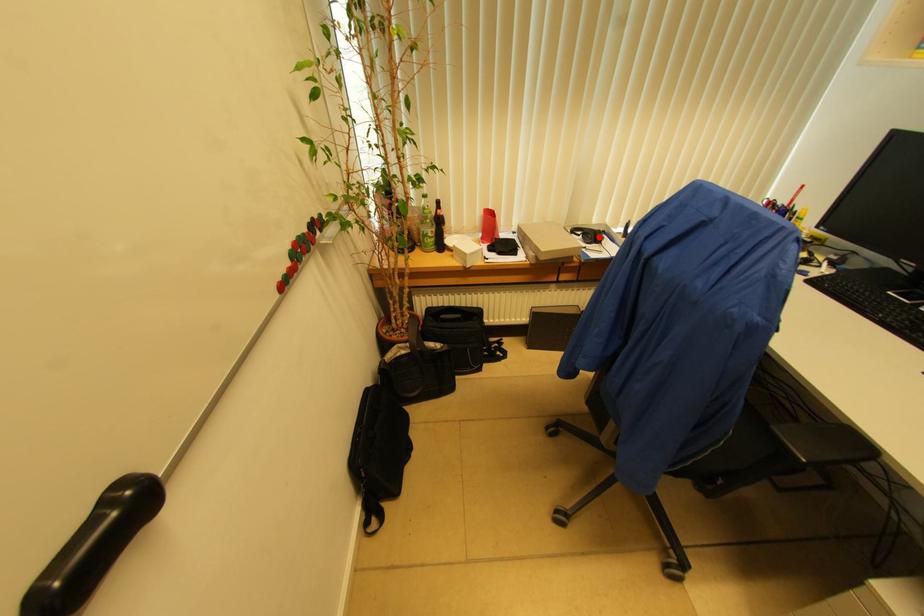
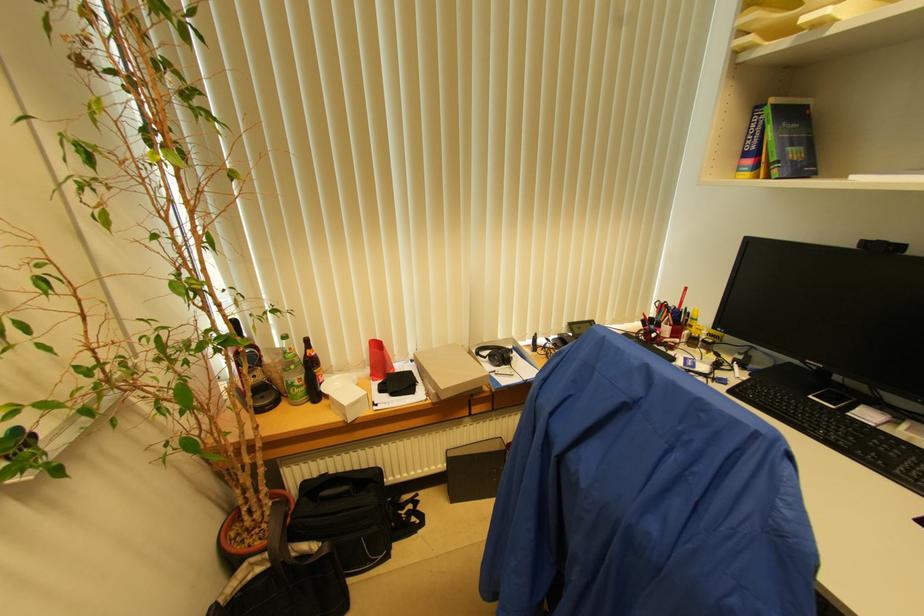
The point at the highlighted location is marked in the first image. Where is the corresponding point in the second image?

(506, 358)